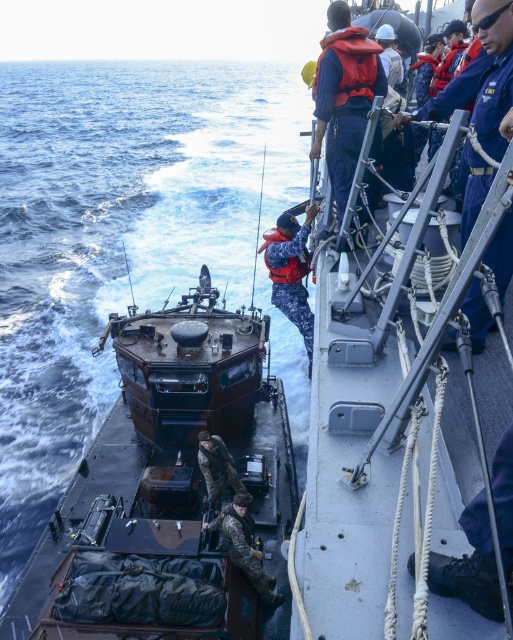
You are a sailor on the naval ship observing the scene. You need to determine the order of the camouflage fabric soldier at center and the red nylon life jacket at center from your viewpoint. Which one is closer to you?

The camouflage fabric soldier at center is closer to you than the red nylon life jacket at center.